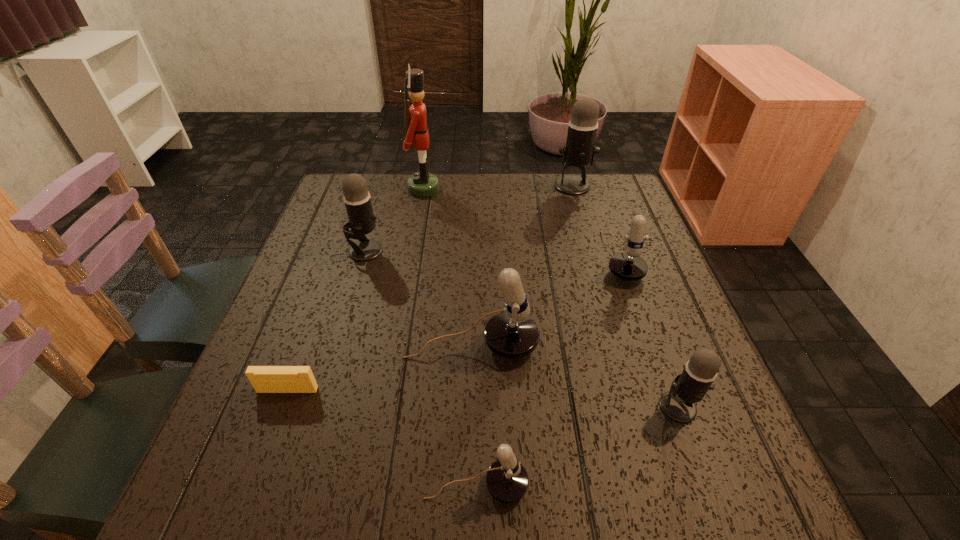
Where is `the nearest gray microphone`? the nearest gray microphone is located at coordinates (689, 387).

At what (x,y) coordinates should I click in order to perform the action: click on the fifth farthest microphone. Please return your answer as a coordinate pair (x, y). Looking at the image, I should click on (689, 387).

Where is `the nearest white microphone`? The image size is (960, 540). the nearest white microphone is located at coordinates (507, 481).

The width and height of the screenshot is (960, 540). In order to click on the nearest microphone in this screenshot , I will do `click(507, 481)`.

Where is `beige videotape`? This screenshot has width=960, height=540. beige videotape is located at coordinates (265, 379).

Where is `videotape`? Image resolution: width=960 pixels, height=540 pixels. videotape is located at coordinates (265, 379).

Identify the location of vacant position located on the front-facing side of the green nutcracker. Image resolution: width=960 pixels, height=540 pixels. click(479, 188).

Identify the location of free space located on the left of the farthest microphone. The image size is (960, 540). (492, 186).

This screenshot has height=540, width=960. I want to click on vacant position located on the back of the second nearest gray microphone, so click(388, 174).

Image resolution: width=960 pixels, height=540 pixels. In order to click on vacant space located 0.100m on the back of the fourth nearest object in this screenshot , I will do `click(472, 292)`.